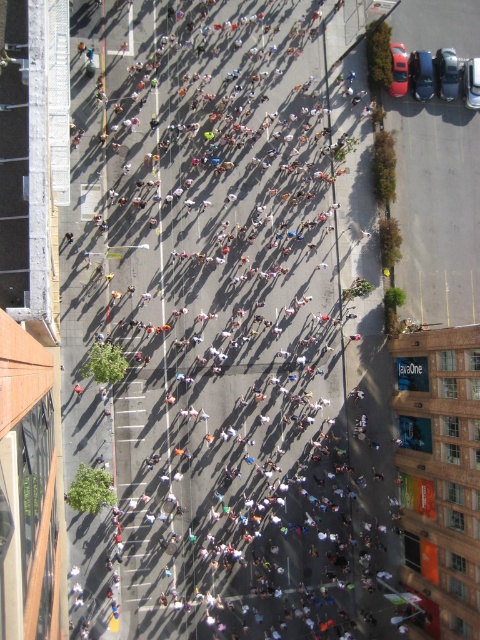
Question: Can you confirm if shiny black sedan at upper right is thinner than metallic silver car at upper right?

Choices:
 (A) no
 (B) yes

Answer: (A)

Question: Which object appears farthest from the camera in this image?

Choices:
 (A) metallic silver car at upper right
 (B) shiny black sedan at upper right

Answer: (B)

Question: Which point is farther from the camera taking this photo?

Choices:
 (A) (393, 61)
 (B) (422, 61)

Answer: (B)

Question: Can you confirm if shiny black sedan at upper right is positioned below metallic silver car at upper right?

Choices:
 (A) no
 (B) yes

Answer: (B)

Question: In this image, where is shiny black sedan at upper right located relative to metallic silver car at upper right?

Choices:
 (A) right
 (B) left

Answer: (A)